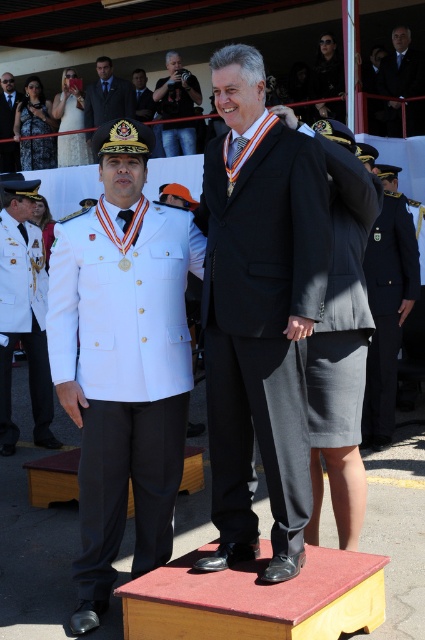
Is denim jeans at upper center smaller than white satin dress at upper left?

Incorrect, denim jeans at upper center is not smaller in size than white satin dress at upper left.

Is denim jeans at upper center above white satin dress at upper left?

Actually, denim jeans at upper center is below white satin dress at upper left.

Does point (175, 125) come farther from viewer compared to point (62, 134)?

No, it is in front of (62, 134).

Identify the location of denim jeans at upper center. (176, 90).

Between navy blue fabric uniform at right and matte black dress at upper left, which one appears on the left side from the viewer's perspective?

From the viewer's perspective, matte black dress at upper left appears more on the left side.

Is navy blue fabric uniform at right shorter than matte black dress at upper left?

No, navy blue fabric uniform at right is not shorter than matte black dress at upper left.

Which is in front, point (385, 324) or point (31, 99)?

Point (385, 324) is more forward.

This screenshot has height=640, width=425. What are the coordinates of `navy blue fabric uniform at right` in the screenshot? It's located at (388, 310).

Image resolution: width=425 pixels, height=640 pixels. What do you see at coordinates (388, 310) in the screenshot?
I see `navy blue fabric uniform at right` at bounding box center [388, 310].

Measure the distance from navy blue fabric uniform at right to matte black suit at center.

They are 6.04 meters apart.

Which is behind, point (397, 259) or point (416, 81)?

Point (416, 81)

Find the location of a particular element. navy blue fabric uniform at right is located at coordinates (388, 310).